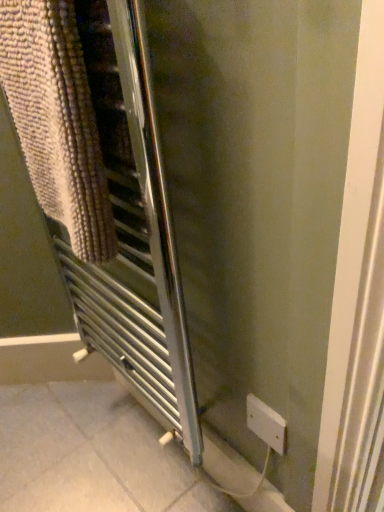
In order to click on metallic silver towel at left in this screenshot , I will do `click(57, 121)`.

The width and height of the screenshot is (384, 512). What do you see at coordinates (57, 121) in the screenshot? I see `metallic silver towel at left` at bounding box center [57, 121].

Where is `metallic silver towel at left`? Image resolution: width=384 pixels, height=512 pixels. metallic silver towel at left is located at coordinates (57, 121).